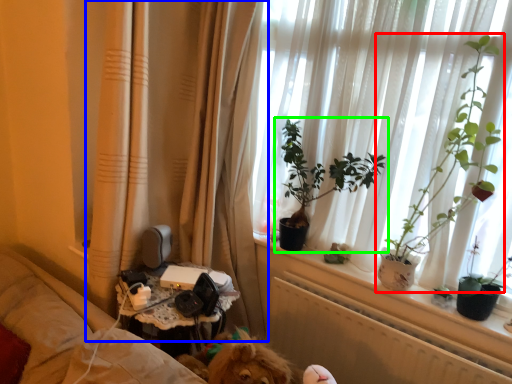
Question: Considering the real-world distances, which object is closest to houseplant (highlighted by a red box)? curtain (highlighted by a blue box) or houseplant (highlighted by a green box).

Choices:
 (A) curtain
 (B) houseplant

Answer: (B)